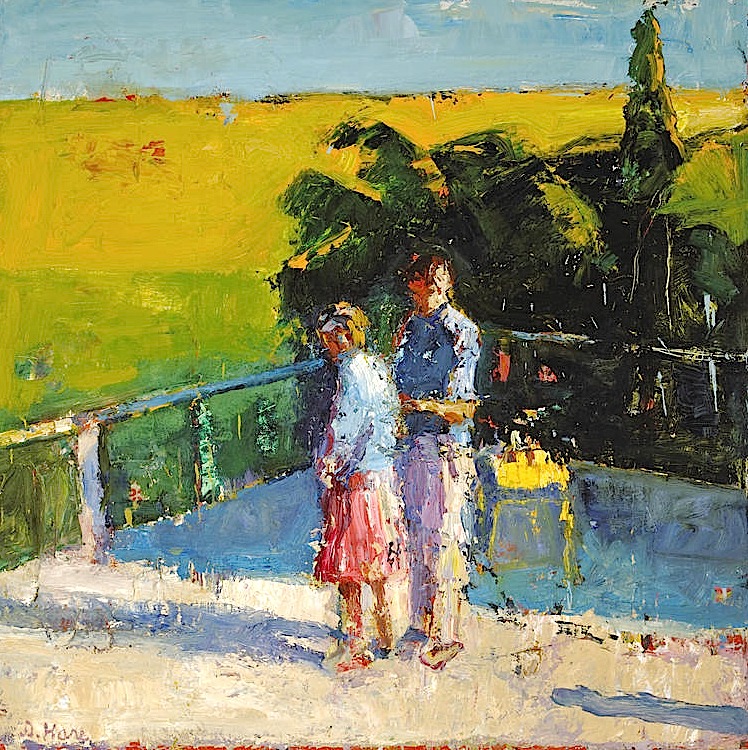
Identify the location of yellow table. The width and height of the screenshot is (748, 750). (523, 460).